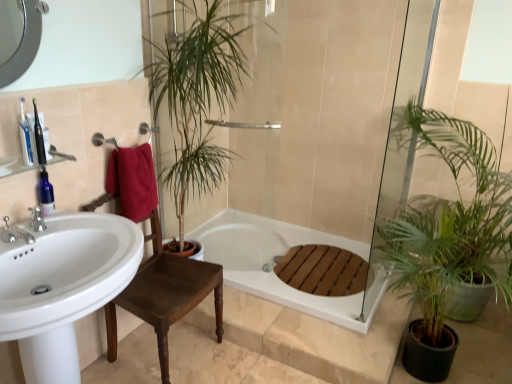
Question: From a real-world perspective, is silver metallic faucet at left, acting as the first tap starting from the back, positioned over white glossy sink at left based on gravity?

Choices:
 (A) yes
 (B) no

Answer: (A)

Question: Is the position of silver metallic faucet at left, the second tap viewed from the front, less distant than that of white glossy sink at left?

Choices:
 (A) no
 (B) yes

Answer: (A)

Question: From the image's perspective, is silver metallic faucet at left, acting as the first tap starting from the back, on top of white glossy sink at left?

Choices:
 (A) yes
 (B) no

Answer: (A)

Question: From a real-world perspective, is silver metallic faucet at left, acting as the first tap starting from the back, physically below white glossy sink at left?

Choices:
 (A) no
 (B) yes

Answer: (A)

Question: Does silver metallic faucet at left, acting as the first tap starting from the back, appear on the left side of white glossy sink at left?

Choices:
 (A) no
 (B) yes

Answer: (B)

Question: Is blue glass toothbrush at upper left inside the boundaries of brown wooden chair at center, or outside?

Choices:
 (A) outside
 (B) inside

Answer: (A)

Question: Is point (66, 157) positioned closer to the camera than point (150, 238)?

Choices:
 (A) farther
 (B) closer

Answer: (B)

Question: From their relative heights in the image, would you say blue glass toothbrush at upper left is taller or shorter than brown wooden chair at center?

Choices:
 (A) short
 (B) tall

Answer: (A)

Question: Is blue glass toothbrush at upper left wider or thinner than brown wooden chair at center?

Choices:
 (A) wide
 (B) thin

Answer: (B)

Question: Is green leafy plant at center, which appears as the 1th houseplant when viewed from the left, situated inside blue glass toothbrush at upper left or outside?

Choices:
 (A) outside
 (B) inside

Answer: (A)

Question: Is green leafy plant at center, which appears as the 1th houseplant when viewed from the left, taller or shorter than blue glass toothbrush at upper left?

Choices:
 (A) tall
 (B) short

Answer: (A)

Question: Considering the positions of green leafy plant at center, which appears as the 1th houseplant when viewed from the left, and blue glass toothbrush at upper left in the image, is green leafy plant at center, which appears as the 1th houseplant when viewed from the left, wider or thinner than blue glass toothbrush at upper left?

Choices:
 (A) wide
 (B) thin

Answer: (A)

Question: From a real-world perspective, is green leafy plant at center, which appears as the 1th houseplant when viewed from the left, above or below blue glass toothbrush at upper left?

Choices:
 (A) above
 (B) below

Answer: (B)

Question: Based on their positions, is brown wooden chair at center located to the left or right of white glossy sink at left?

Choices:
 (A) left
 (B) right

Answer: (B)

Question: Does point (196, 269) appear closer or farther from the camera than point (58, 350)?

Choices:
 (A) closer
 (B) farther

Answer: (B)